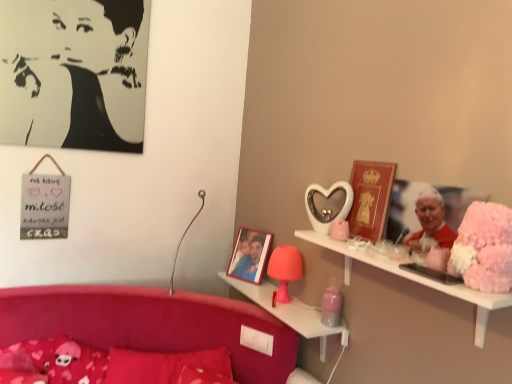
What do you see at coordinates (291, 313) in the screenshot?
I see `matte pink lamp at center, the 1th shelf from the bottom` at bounding box center [291, 313].

Where is `black paper portrait at upper left`? The image size is (512, 384). black paper portrait at upper left is located at coordinates (74, 73).

What is the approximate height of fluffy pink pillow at lower left, which ranks as the second pillow in right-to-left order?

The height of fluffy pink pillow at lower left, which ranks as the second pillow in right-to-left order, is 7.08 inches.

Locate an element on the screen. The height and width of the screenshot is (384, 512). matte pink lamp at center, which is the 1th shelf from back to front is located at coordinates coord(291,313).

Between velvet red pillow at lower left, the 2th pillow viewed from the left, and black paper portrait at upper left, which one has larger size?

With larger size is velvet red pillow at lower left, the 2th pillow viewed from the left.

From their relative heights in the image, would you say velvet red pillow at lower left, the 2th pillow viewed from the left, is taller or shorter than black paper portrait at upper left?

Clearly, velvet red pillow at lower left, the 2th pillow viewed from the left, is shorter compared to black paper portrait at upper left.

Between point (141, 380) and point (62, 141), which one is positioned in front?

The point (141, 380) is closer to the camera.

From a real-world perspective, between velvet red pillow at lower left, positioned as the 1th pillow in right-to-left order, and black paper portrait at upper left, who is vertically lower?

velvet red pillow at lower left, positioned as the 1th pillow in right-to-left order, from a real-world perspective.

Is matte pink lamp at center, which is the 1th shelf from back to front, wider than metallic silver table lamp at center, which is the first table lamp in left-to-right order?

No.

Choose the correct answer: Is matte pink lamp at center, the 2th shelf in the front-to-back sequence, inside metallic silver table lamp at center, which is the first table lamp in left-to-right order, or outside it?

matte pink lamp at center, the 2th shelf in the front-to-back sequence, is not enclosed by metallic silver table lamp at center, which is the first table lamp in left-to-right order.

Is matte pink lamp at center, which is the 1th shelf from back to front, looking in the opposite direction of metallic silver table lamp at center, which is the second table lamp from right to left?

No, metallic silver table lamp at center, which is the second table lamp from right to left, is not at the back of matte pink lamp at center, which is the 1th shelf from back to front.

From the image's perspective, which one is positioned higher, fluffy pink pillow at lower left, which ranks as the second pillow in right-to-left order, or velvet red pillow at lower left, positioned as the 1th pillow in right-to-left order?

fluffy pink pillow at lower left, which ranks as the second pillow in right-to-left order, is shown above in the image.

Considering the sizes of objects fluffy pink pillow at lower left, which ranks as the second pillow in right-to-left order, and velvet red pillow at lower left, the 2th pillow viewed from the left, in the image provided, who is thinner, fluffy pink pillow at lower left, which ranks as the second pillow in right-to-left order, or velvet red pillow at lower left, the 2th pillow viewed from the left,?

Thinner between the two is fluffy pink pillow at lower left, which ranks as the second pillow in right-to-left order.

Does point (39, 350) come in front of point (192, 353)?

Yes.

Is fluffy pink pillow at lower left, the 1th pillow positioned from the left, turned away from velvet red pillow at lower left, the 2th pillow viewed from the left?

No, velvet red pillow at lower left, the 2th pillow viewed from the left, is not at the back of fluffy pink pillow at lower left, the 1th pillow positioned from the left.

From a real-world perspective, is velvet red pillow at lower left, positioned as the 1th pillow in right-to-left order, over metallic silver table lamp at center, which is the first table lamp in left-to-right order?

No.

How many degrees apart are the facing directions of velvet red pillow at lower left, positioned as the 1th pillow in right-to-left order, and metallic silver table lamp at center, which is the second table lamp from right to left?

There is a 3.42-degree angle between the facing directions of velvet red pillow at lower left, positioned as the 1th pillow in right-to-left order, and metallic silver table lamp at center, which is the second table lamp from right to left.

Considering the positions of objects velvet red pillow at lower left, the 2th pillow viewed from the left, and metallic silver table lamp at center, which is the first table lamp in left-to-right order, in the image provided, who is behind, velvet red pillow at lower left, the 2th pillow viewed from the left, or metallic silver table lamp at center, which is the first table lamp in left-to-right order,?

metallic silver table lamp at center, which is the first table lamp in left-to-right order, is behind.

Is velvet red pillow at lower left, positioned as the 1th pillow in right-to-left order, located outside metallic silver table lamp at center, which is the first table lamp in left-to-right order?

Indeed, velvet red pillow at lower left, positioned as the 1th pillow in right-to-left order, is completely outside metallic silver table lamp at center, which is the first table lamp in left-to-right order.

Between matte pink plastic table lamp at center, the first table lamp viewed from the right, and velvet red pillow at lower left, positioned as the 1th pillow in right-to-left order, which one has larger width?

velvet red pillow at lower left, positioned as the 1th pillow in right-to-left order.

Is matte pink plastic table lamp at center, which appears as the 2th table lamp when viewed from the left, positioned with its back to velvet red pillow at lower left, positioned as the 1th pillow in right-to-left order?

No, matte pink plastic table lamp at center, which appears as the 2th table lamp when viewed from the left, is not facing the opposite direction of velvet red pillow at lower left, positioned as the 1th pillow in right-to-left order.

Is matte pink plastic table lamp at center, which appears as the 2th table lamp when viewed from the left, shorter than velvet red pillow at lower left, positioned as the 1th pillow in right-to-left order?

Incorrect, the height of matte pink plastic table lamp at center, which appears as the 2th table lamp when viewed from the left, does not fall short of that of velvet red pillow at lower left, positioned as the 1th pillow in right-to-left order.

Measure the distance from matte pink plastic table lamp at center, the first table lamp viewed from the right, to velvet red pillow at lower left, positioned as the 1th pillow in right-to-left order.

They are 20.25 inches apart.

There is a matte pink lamp at center, the 2th shelf in the front-to-back sequence. At what (x,y) coordinates should I click in order to perform the action: click on the 1st table lamp above it (from a real-world perspective). Please return your answer as a coordinate pair (x, y). The image size is (512, 384). Looking at the image, I should click on (285, 269).

From the image's perspective, is matte pink plastic table lamp at center, which appears as the 2th table lamp when viewed from the left, above or below matte pink lamp at center, arranged as the second shelf when viewed from the top?

Clearly, from the image's perspective, matte pink plastic table lamp at center, which appears as the 2th table lamp when viewed from the left, is above matte pink lamp at center, arranged as the second shelf when viewed from the top.

Is matte pink plastic table lamp at center, which appears as the 2th table lamp when viewed from the left, oriented towards matte pink lamp at center, which is the 1th shelf from back to front?

No, matte pink plastic table lamp at center, which appears as the 2th table lamp when viewed from the left, does not turn towards matte pink lamp at center, which is the 1th shelf from back to front.

Is black paper portrait at upper left located outside white matte shelf at upper right, arranged as the 1th shelf when viewed from the front?

Yes.

From a real-world perspective, which is physically below, black paper portrait at upper left or white matte shelf at upper right, which ranks as the second shelf in bottom-to-top order?

In real-world perspective, white matte shelf at upper right, which ranks as the second shelf in bottom-to-top order, is lower.

Does black paper portrait at upper left have a greater width compared to white matte shelf at upper right, marked as the second shelf in a back-to-front arrangement?

No, black paper portrait at upper left is not wider than white matte shelf at upper right, marked as the second shelf in a back-to-front arrangement.

Identify the location of person above the velvet red pillow at lower left, the 2th pillow viewed from the left (from a real-world perspective). (74, 73).

Where is `table lamp that is the 1st object located behind the matte pink lamp at center, the 2th shelf in the front-to-back sequence`? Image resolution: width=512 pixels, height=384 pixels. table lamp that is the 1st object located behind the matte pink lamp at center, the 2th shelf in the front-to-back sequence is located at coordinates (183, 238).

Considering their positions, is black paper portrait at upper left positioned further to matte pink plastic table lamp at center, the first table lamp viewed from the right, than metallic silver table lamp at center, which is the second table lamp from right to left?

Based on the image, black paper portrait at upper left appears to be further to matte pink plastic table lamp at center, the first table lamp viewed from the right.

Which object lies further to the anchor point matte pink lamp at center, the 1th shelf from the bottom, matte pink plastic table lamp at center, the first table lamp viewed from the right, or white matte shelf at upper right, arranged as the 1th shelf when viewed from the front?

white matte shelf at upper right, arranged as the 1th shelf when viewed from the front, is further to matte pink lamp at center, the 1th shelf from the bottom.

Based on their spatial positions, is matte pink lamp at center, which is the 1th shelf from back to front, or velvet red pillow at lower left, the 2th pillow viewed from the left, closer to matte pink plastic table lamp at center, which appears as the 2th table lamp when viewed from the left?

matte pink lamp at center, which is the 1th shelf from back to front, is closer to matte pink plastic table lamp at center, which appears as the 2th table lamp when viewed from the left.

Looking at the image, which one is located further to velvet red pillow at lower left, positioned as the 1th pillow in right-to-left order, black paper portrait at upper left or fluffy pink pillow at lower left, the 1th pillow positioned from the left?

black paper portrait at upper left.

From the image, which object appears to be nearer to metallic silver table lamp at center, which is the second table lamp from right to left, white matte shelf at upper right, which ranks as the second shelf in bottom-to-top order, or matte pink lamp at center, the 1th shelf from the bottom?

matte pink lamp at center, the 1th shelf from the bottom, is closer to metallic silver table lamp at center, which is the second table lamp from right to left.

Based on their spatial positions, is black paper portrait at upper left or fluffy pink pillow at lower left, which ranks as the second pillow in right-to-left order, closer to matte pink lamp at center, which is the 1th shelf from back to front?

The object closer to matte pink lamp at center, which is the 1th shelf from back to front, is fluffy pink pillow at lower left, which ranks as the second pillow in right-to-left order.

Considering their positions, is metallic silver table lamp at center, which is the second table lamp from right to left, positioned further to fluffy pink pillow at lower left, which ranks as the second pillow in right-to-left order, than matte pink lamp at center, the 1th shelf from the bottom?

matte pink lamp at center, the 1th shelf from the bottom.

Considering their positions, is black paper portrait at upper left positioned closer to fluffy pink pillow at lower left, the 1th pillow positioned from the left, than velvet red pillow at lower left, positioned as the 1th pillow in right-to-left order?

velvet red pillow at lower left, positioned as the 1th pillow in right-to-left order, is positioned closer to the anchor fluffy pink pillow at lower left, the 1th pillow positioned from the left.

Locate an element on the screen. The width and height of the screenshot is (512, 384). pillow between metallic silver table lamp at center, which is the second table lamp from right to left, and velvet red pillow at lower left, the 2th pillow viewed from the left, vertically is located at coordinates (52, 362).

Locate an element on the screen. shelf between white matte shelf at upper right, which ranks as the second shelf in bottom-to-top order, and metallic silver table lamp at center, which is the second table lamp from right to left, along the z-axis is located at coordinates (291, 313).

What are the coordinates of `shelf between black paper portrait at upper left and white matte shelf at upper right, arranged as the 1th shelf when viewed from the front` in the screenshot? It's located at point(291,313).

The height and width of the screenshot is (384, 512). Find the location of `shelf between fluffy pink pillow at lower left, the 1th pillow positioned from the left, and matte pink plastic table lamp at center, the first table lamp viewed from the right, from left to right`. shelf between fluffy pink pillow at lower left, the 1th pillow positioned from the left, and matte pink plastic table lamp at center, the first table lamp viewed from the right, from left to right is located at coordinates (291, 313).